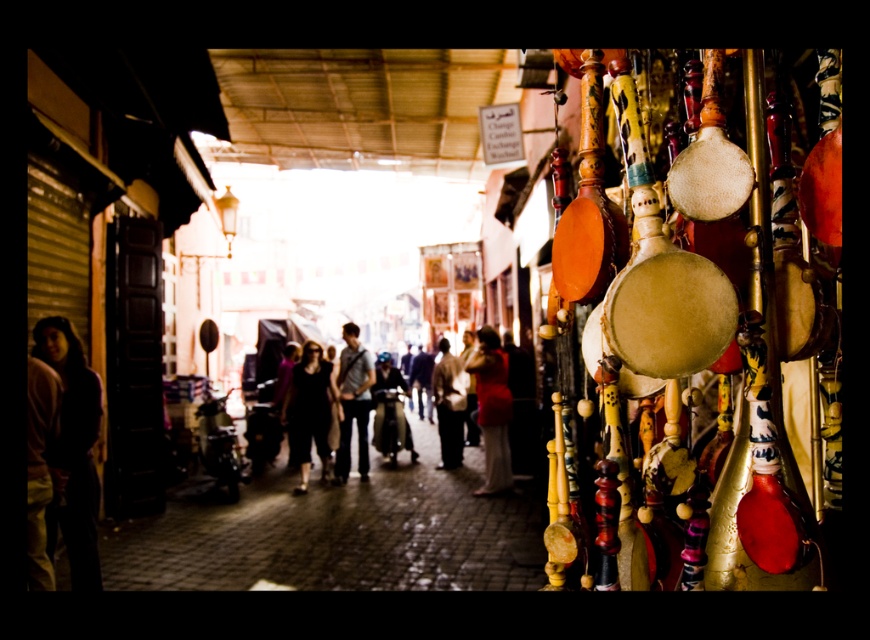
Question: Which object appears closest to the camera in this image?

Choices:
 (A) dark gray jeans at center
 (B) dark clothing at center

Answer: (B)

Question: Which point is farther to the camera?

Choices:
 (A) (134, 540)
 (B) (350, 339)
 (C) (372, 380)

Answer: (B)

Question: Does matte black scooter at center appear over dark matte clothing at center?

Choices:
 (A) no
 (B) yes

Answer: (A)

Question: Which object is positioned closest to the dark clothing at center?

Choices:
 (A) dark blue leather jacket at center
 (B) brown fabric pants at lower left
 (C) dark gray jeans at center
 (D) matte black scooter at center

Answer: (C)

Question: Does brown fabric pants at lower left have a larger size compared to dark matte clothing at center?

Choices:
 (A) no
 (B) yes

Answer: (A)

Question: Is brown fabric pants at lower left positioned behind dark matte clothing at center?

Choices:
 (A) no
 (B) yes

Answer: (A)